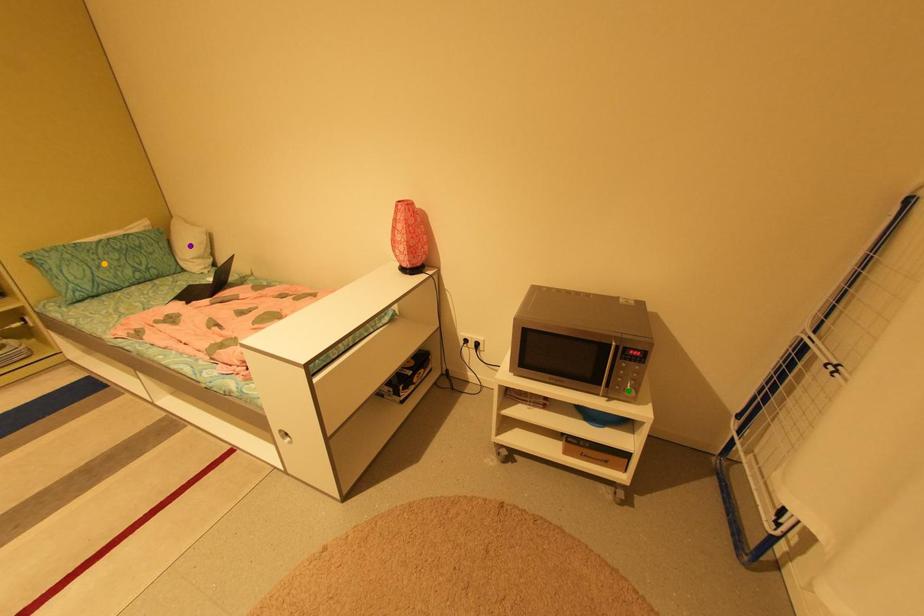
Order these from nearest to farthest:
A) green point
B) purple point
C) orange point

green point < orange point < purple point